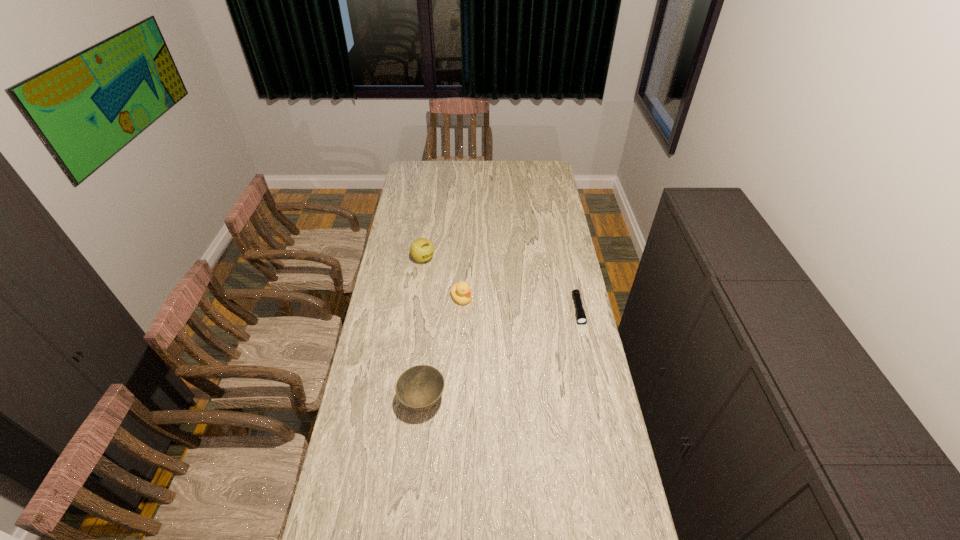
Identify the location of object that is the second closest to the nearest object. (581, 318).

Where is `object that is the second closest to the softball`? object that is the second closest to the softball is located at coordinates (419, 387).

What are the coordinates of `free space in the image that satisfies the following two spatial constraints: 1. on the front side of the farthest object; 2. on the right side of the duckling` in the screenshot? It's located at (418, 298).

Where is `blank area in the image that satisfies the following two spatial constraints: 1. on the back side of the bowl; 2. on the left side of the duckling`? The image size is (960, 540). blank area in the image that satisfies the following two spatial constraints: 1. on the back side of the bowl; 2. on the left side of the duckling is located at coordinates (433, 298).

Where is `free space that satisfies the following two spatial constraints: 1. on the front side of the duckling; 2. on the right side of the softball`? free space that satisfies the following two spatial constraints: 1. on the front side of the duckling; 2. on the right side of the softball is located at coordinates (418, 298).